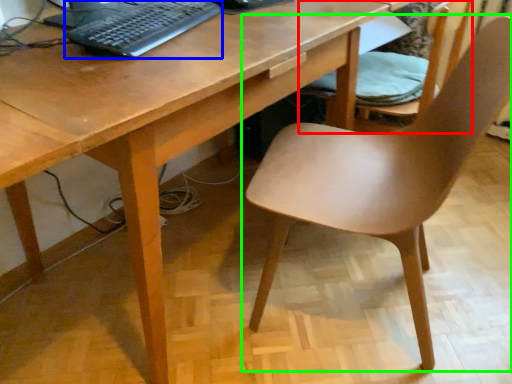
Question: Based on their relative distances, which object is farther from chair (highlighted by a red box)? Choose from computer keyboard (highlighted by a blue box) and chair (highlighted by a green box).

Choices:
 (A) computer keyboard
 (B) chair

Answer: (A)